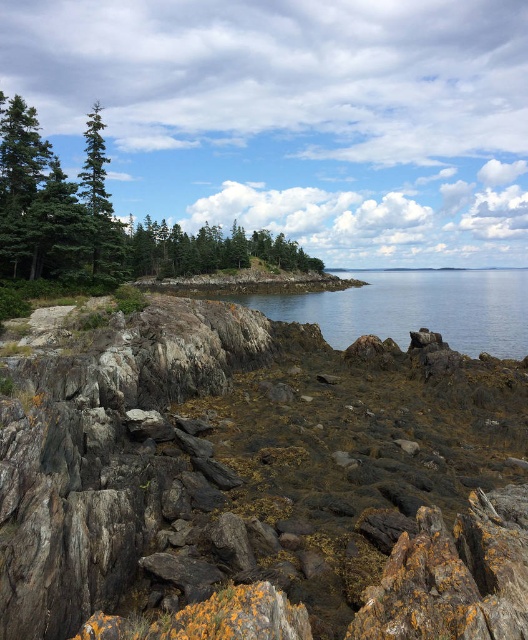
You are a hiker trying to navigate through the rocky shoreline. You see the green matte tree at upper left and the green matte trees at center. Which of these landmarks is positioned lower in the scene?

The green matte tree at upper left is positioned below the green matte trees at center, so it is lower in the scene.

Looking at this image, you are a hiker exploring the coastal area and want to take a photo of the rusty rock at center and the green matte tree at upper left. Based on their positions, which object should you focus on first if you are moving from left to right across the scene?

You should focus on the green matte tree at upper left first because the rusty rock at center is to its right, so moving left to right, the tree comes before the rock.